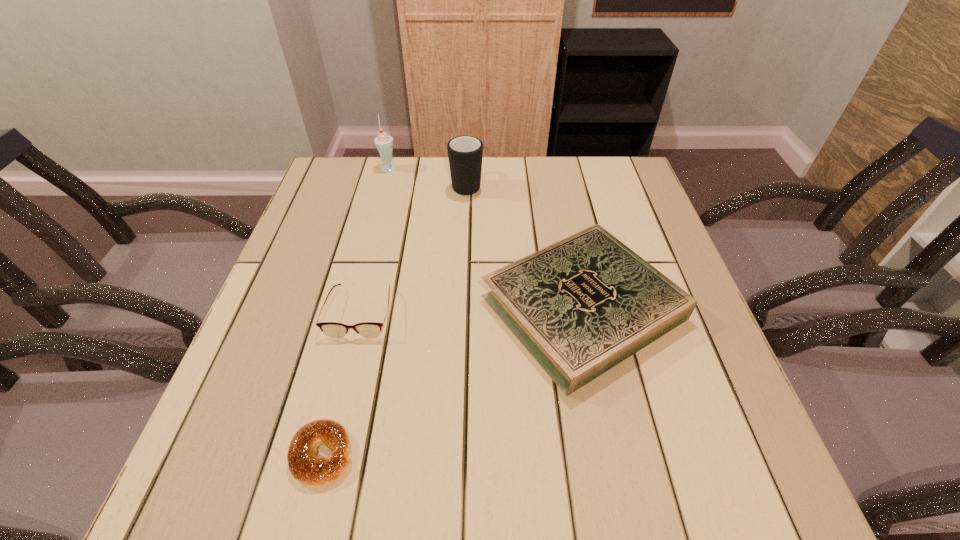
Where is `free space between the hardback book and the fourth tallest object`? free space between the hardback book and the fourth tallest object is located at coordinates (471, 309).

Where is `free spot between the milkshake and the hardback book`? Image resolution: width=960 pixels, height=540 pixels. free spot between the milkshake and the hardback book is located at coordinates (486, 237).

Locate an element on the screen. blank region between the milkshake and the spectacles is located at coordinates (374, 239).

In order to click on vacant area between the shortest object and the spectacles in this screenshot , I will do `click(342, 383)`.

The image size is (960, 540). Find the location of `vacant region between the mug and the second shortest object`. vacant region between the mug and the second shortest object is located at coordinates (414, 248).

At what (x,y) coordinates should I click in order to perform the action: click on free space that is in between the hardback book and the milkshake. Please return your answer as a coordinate pair (x, y). This screenshot has width=960, height=540. Looking at the image, I should click on (486, 237).

At what (x,y) coordinates should I click in order to perform the action: click on vacant space in between the shortest object and the milkshake. Please return your answer as a coordinate pair (x, y). Image resolution: width=960 pixels, height=540 pixels. Looking at the image, I should click on (356, 310).

The height and width of the screenshot is (540, 960). Identify the location of vacant point located between the bagel and the mug. (395, 319).

Find the location of a particular element. The height and width of the screenshot is (540, 960). vacant point located between the nearest object and the third shortest object is located at coordinates (453, 381).

Locate which object is the third closest to the third tallest object. Please provide its 2D coordinates. Your answer should be formatted as a tuple, i.e. [(x, y)], where the tuple contains the x and y coordinates of a point satisfying the conditions above.

[(306, 466)]